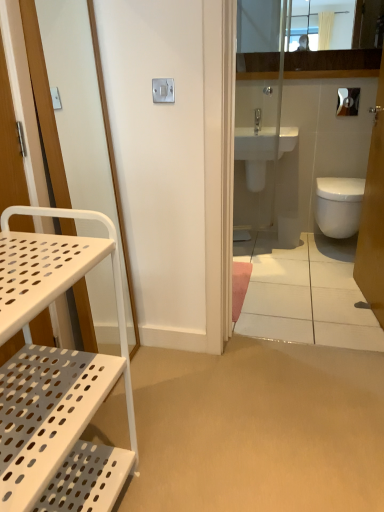
Question: From a real-world perspective, is white glossy screen door at upper right, arranged as the 2th screen door when viewed from the left, above or below silver metallic lock at upper center?

Choices:
 (A) above
 (B) below

Answer: (B)

Question: Does point (372, 144) appear closer or farther from the camera than point (173, 99)?

Choices:
 (A) farther
 (B) closer

Answer: (A)

Question: Estimate the real-world distances between objects in this image. Which object is closer to the white glossy bidet at right, which is the 1th bidet in right-to-left order?

Choices:
 (A) white perforated metal cart at left
 (B) white perforated shelf at left, the second screen door when ordered from right to left
 (C) white glossy toilet paper at upper right
 (D) white glossy toilet at right
 (E) glossy wooden mirror at upper center

Answer: (D)

Question: Which is nearer to the white glossy toilet paper at upper right?

Choices:
 (A) white perforated shelf at left, the second screen door when ordered from right to left
 (B) white perforated metal cart at left
 (C) white glossy screen door at upper right, arranged as the 2th screen door when viewed from the left
 (D) white glossy toilet at right
 (E) silver metallic lock at upper center

Answer: (D)